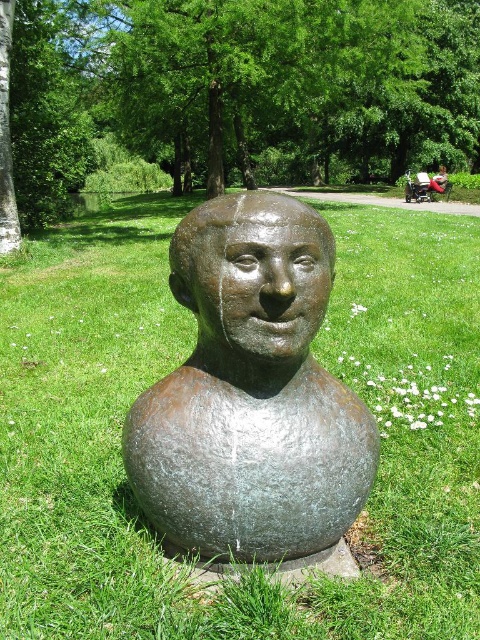
You are standing in front of the bronze bust sculpture in the park. You notice two points marked in the image. Which point is closer to you, point (x=86, y=355) or point (x=124, y=1)?

Point (x=86, y=355) is closer to the viewer than point (x=124, y=1).

You are standing in the park and see the bronze bust sculpture. There is green grass at center and a green leafy tree at center. Which one is closer to you?

The green grass at center is closer to you because it is in front of the green leafy tree at center.